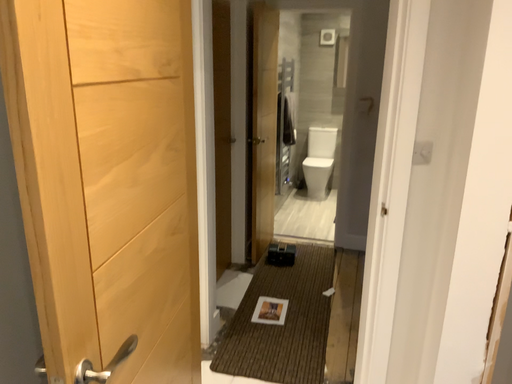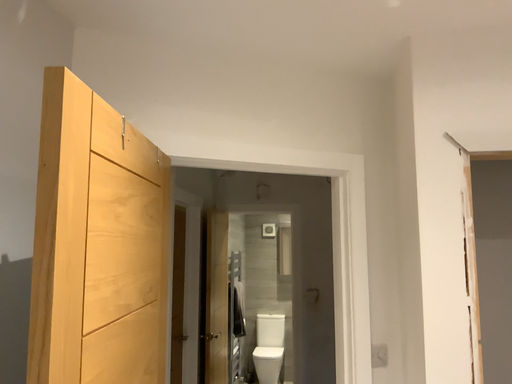
Question: How did the camera likely rotate when shooting the video?

Choices:
 (A) rotated upward
 (B) rotated downward

Answer: (A)